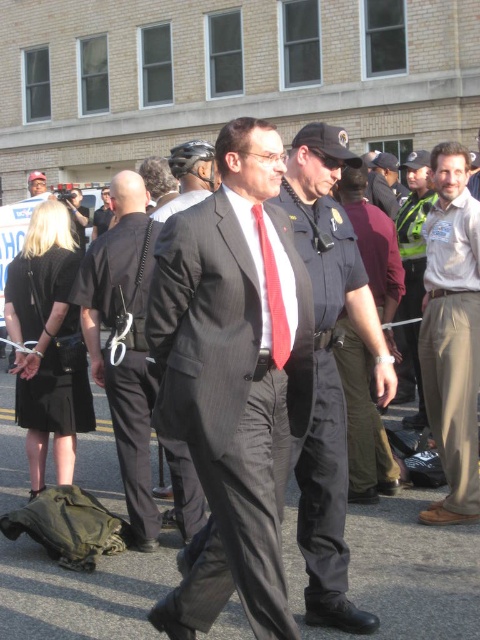
From the picture: You are a photographer at the event and need to capture both the dark gray uniform at center and the dark gray suit at center in a single frame. Which object should you focus on first to ensure both are in the frame without moving the camera?

You should focus on the dark gray uniform at center first because it is bigger than the dark gray suit at center, so centering it will ensure the smaller suit is also within the frame.

You are a photographer at the event and want to capture both the dark gray uniform at center and the dark gray suit at center in a single photo. Which one should you focus on first to ensure both are in frame?

You should focus on the dark gray uniform at center first since it is in front of the dark gray suit at center, ensuring both are captured in the photo.